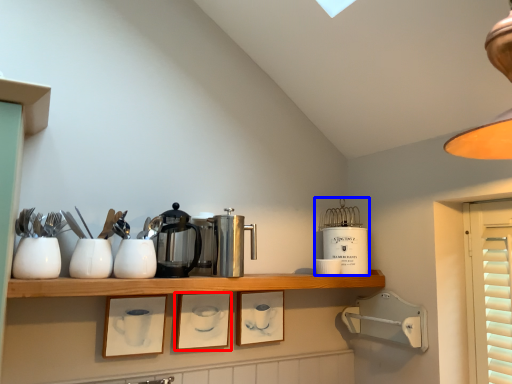
Question: Which point is further to the camera, picture frame (highlighted by a red box) or appliance (highlighted by a blue box)?

Choices:
 (A) picture frame
 (B) appliance

Answer: (B)